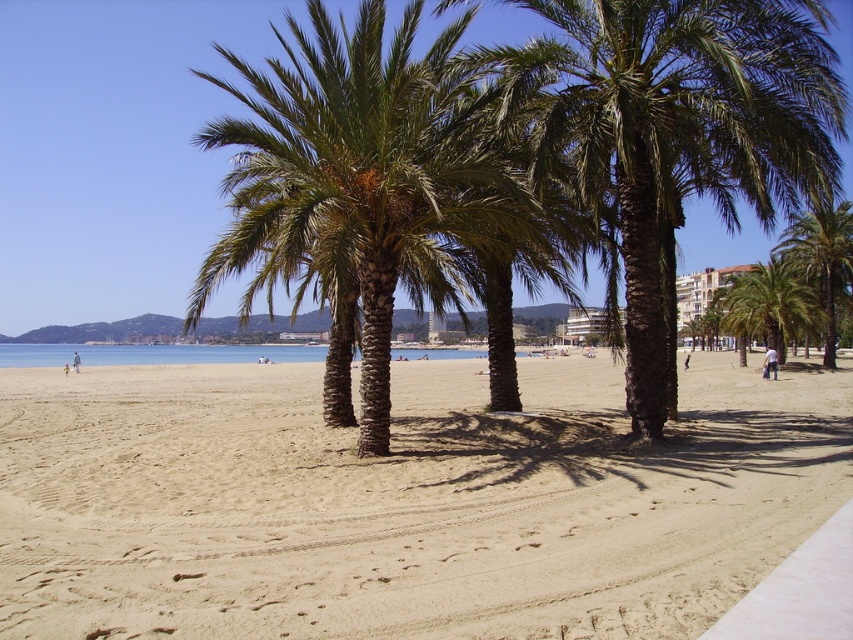
You are standing on the beach and see the point marked at coordinates (358, 173). What object does this point correspond to?

The point at coordinates (358, 173) corresponds to the green brown textured palm trees at center.

You are standing at the beach and want to reach the two points marked in the image. Which point, point [202,285] or point [798,333], is closer to you?

Point [202,285] is closer to the viewer than point [798,333].